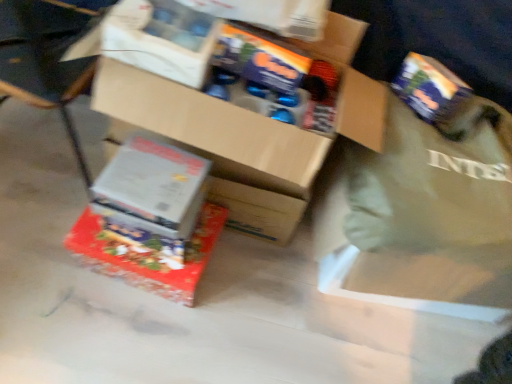
This screenshot has height=384, width=512. I want to click on vacant point above white cardboard box at lower left, marked as the 2th box in a top-to-bottom arrangement (from a real-world perspective), so click(155, 172).